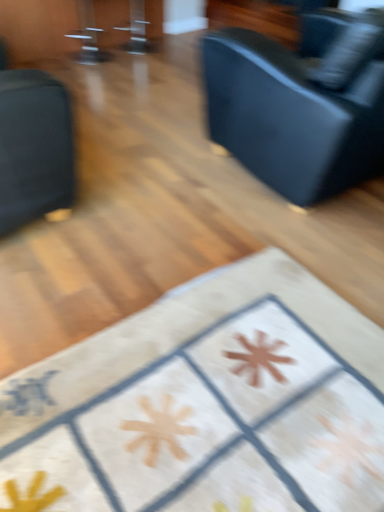
Question: Is white fabric rug at center, marked as the 2th furniture in a left-to-right arrangement, bigger or smaller than black leather couch at upper right?

Choices:
 (A) small
 (B) big

Answer: (A)

Question: Considering the positions of white fabric rug at center, the first furniture in the right-to-left sequence, and black leather couch at upper right in the image, is white fabric rug at center, the first furniture in the right-to-left sequence, wider or thinner than black leather couch at upper right?

Choices:
 (A) thin
 (B) wide

Answer: (A)

Question: Which object is positioned closest to the matte black couch at left, marked as the 1th furniture in a left-to-right arrangement?

Choices:
 (A) black leather couch at upper right
 (B) white fabric rug at center, the first furniture in the right-to-left sequence

Answer: (B)

Question: Estimate the real-world distances between objects in this image. Which object is closer to the black leather couch at upper right?

Choices:
 (A) white fabric rug at center, the first furniture in the right-to-left sequence
 (B) matte black couch at left, marked as the 1th furniture in a left-to-right arrangement

Answer: (B)